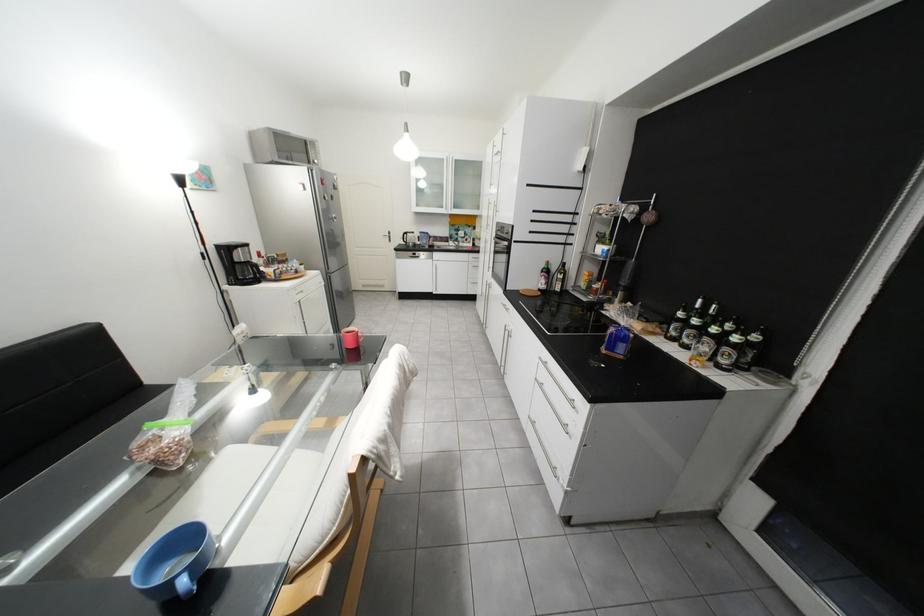
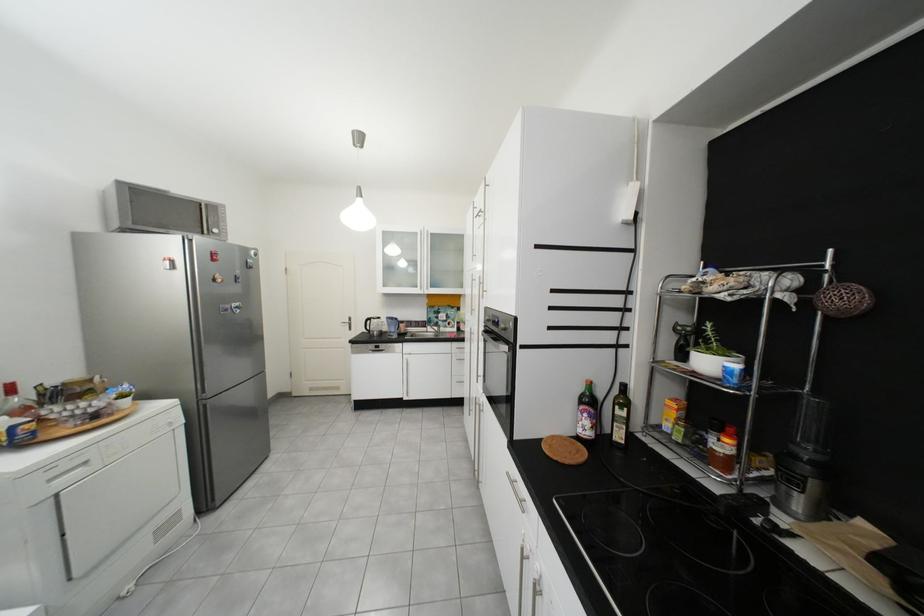
Where in the second image is the point corresponding to the point at 418,235 from the first image?

(381, 321)